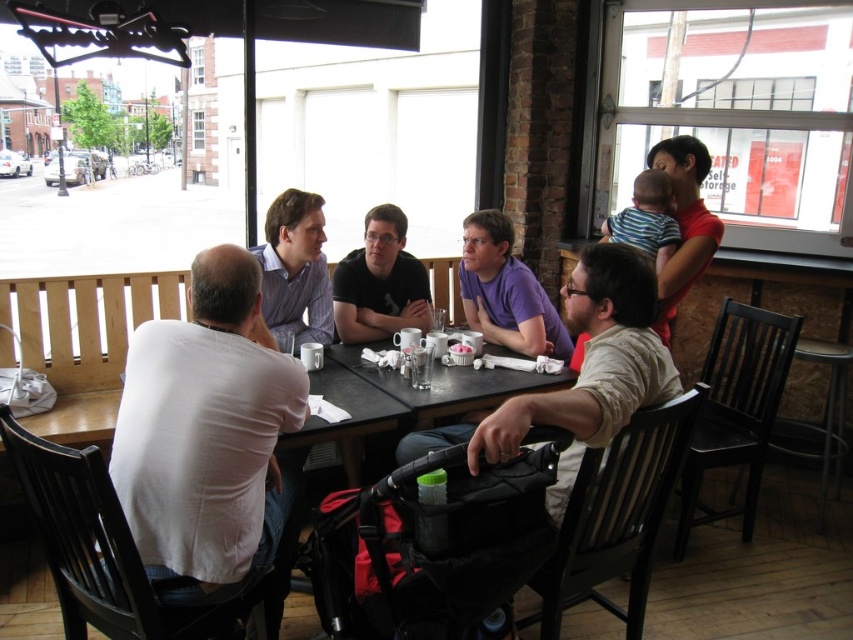
Question: Which object is the closest to the matte black shirt at center?

Choices:
 (A) striped shirt at center
 (B) matte black shirt at upper right
 (C) matte black stroller at center

Answer: (A)

Question: Is matte black shirt at center in front of matte black shirt at upper right?

Choices:
 (A) no
 (B) yes

Answer: (A)

Question: Estimate the real-world distances between objects in this image. Which object is farther from the purple cotton shirt at center?

Choices:
 (A) striped shirt at center
 (B) matte black shirt at upper right
 (C) matte black shirt at center
 (D) matte black stroller at center

Answer: (D)

Question: Is striped shirt at center smaller than matte black shirt at upper right?

Choices:
 (A) yes
 (B) no

Answer: (A)

Question: Which is nearer to the white cotton shirt at center?

Choices:
 (A) matte black shirt at center
 (B) purple cotton shirt at center
 (C) matte black shirt at upper right
 (D) striped shirt at center

Answer: (D)

Question: Is purple cotton shirt at center thinner than matte black shirt at upper right?

Choices:
 (A) no
 (B) yes

Answer: (A)